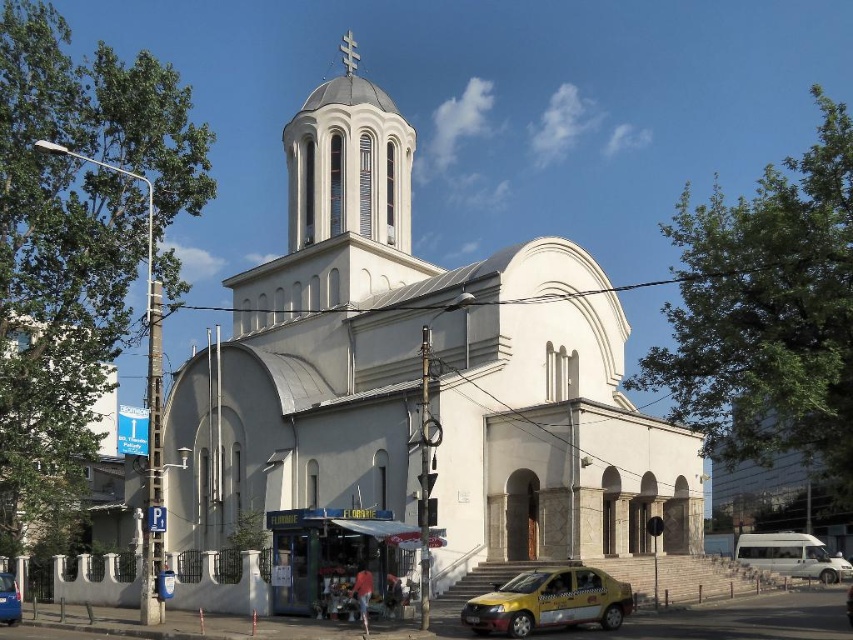
Does white smooth church at center have a greater width compared to blue metallic car at lower left?

Correct, the width of white smooth church at center exceeds that of blue metallic car at lower left.

Between white smooth church at center and blue metallic car at lower left, which one is positioned lower?

blue metallic car at lower left is below.

Identify the location of white smooth church at center. (419, 376).

Find the location of a particular element. The height and width of the screenshot is (640, 853). white smooth dome at upper center is located at coordinates (347, 163).

Who is more forward, (x=375, y=124) or (x=544, y=618)?

Point (x=544, y=618) is more forward.

Find the location of `white smooth dome at upper center`. white smooth dome at upper center is located at coordinates (347, 163).

Which is above, white smooth church at center or white matte van at lower right?

white smooth church at center is higher up.

Can you confirm if white smooth church at center is positioned to the left of white matte van at lower right?

Indeed, white smooth church at center is positioned on the left side of white matte van at lower right.

Is point (421, 355) farther from camera compared to point (737, 545)?

No, (421, 355) is closer to viewer.

In order to click on white smooth church at center in this screenshot , I will do `click(419, 376)`.